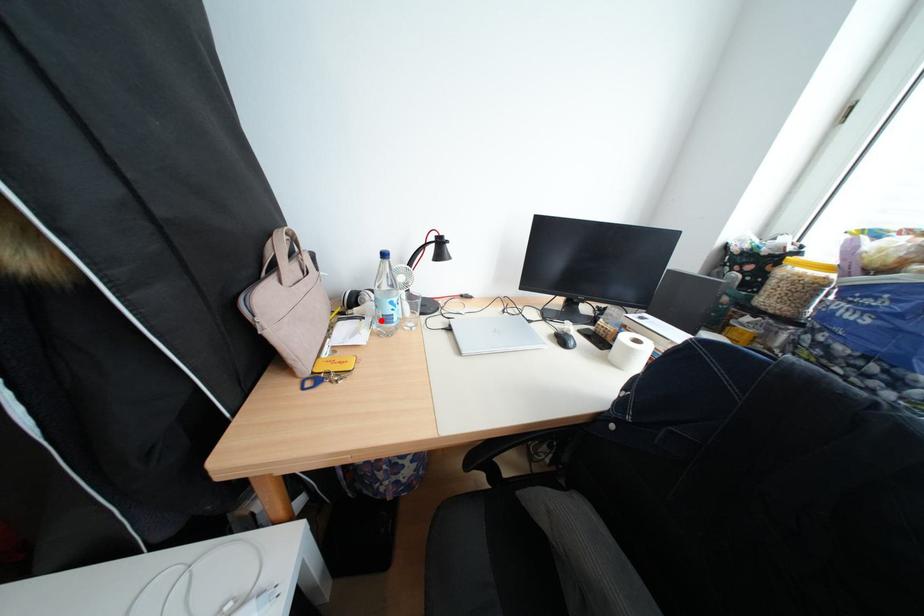
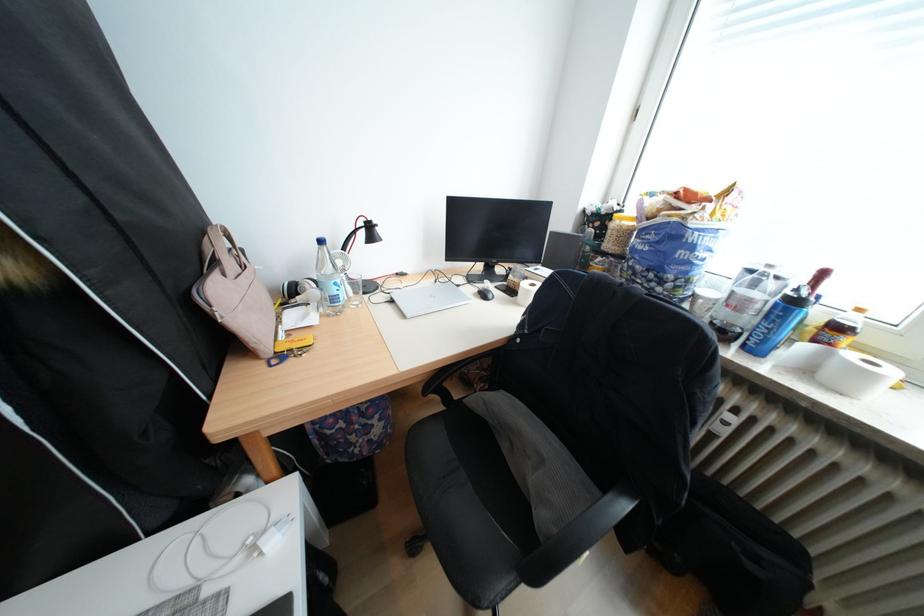
Locate, in the second image, the point that corresponds to the highlighted location in the first image.

(325, 306)